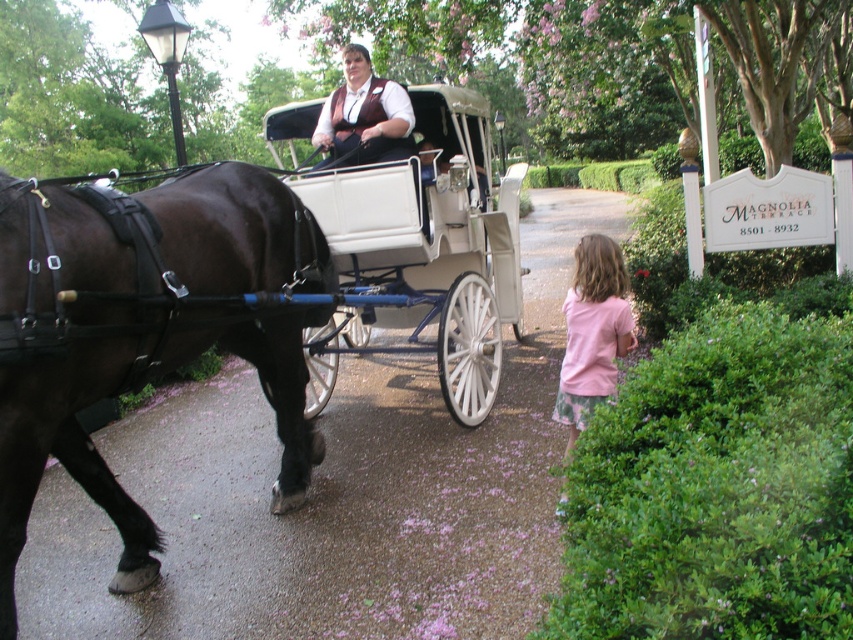
Question: Which of the following is the closest to the observer?

Choices:
 (A) pink cotton shirt at lower right
 (B) matte brown vest at center
 (C) shiny black horse at left

Answer: (C)

Question: Can you confirm if shiny black horse at left is positioned above matte brown vest at center?

Choices:
 (A) no
 (B) yes

Answer: (A)

Question: Is shiny black horse at left further to camera compared to pink cotton shirt at lower right?

Choices:
 (A) yes
 (B) no

Answer: (B)

Question: Which object is farther from the camera taking this photo?

Choices:
 (A) matte brown vest at center
 (B) shiny black horse at left

Answer: (A)

Question: Which point is closer to the camera taking this photo?

Choices:
 (A) (33, 385)
 (B) (346, 92)
 (C) (596, 301)

Answer: (A)

Question: Is pink cotton shirt at lower right behind matte brown vest at center?

Choices:
 (A) no
 (B) yes

Answer: (A)